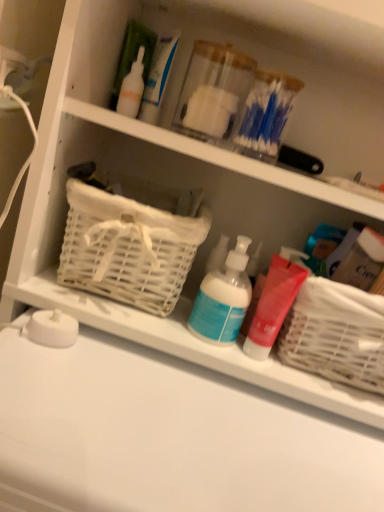
Where is `vacant space in front of white wicker basket at left, which ranks as the first basket in left-to-right order`? vacant space in front of white wicker basket at left, which ranks as the first basket in left-to-right order is located at coordinates (113, 390).